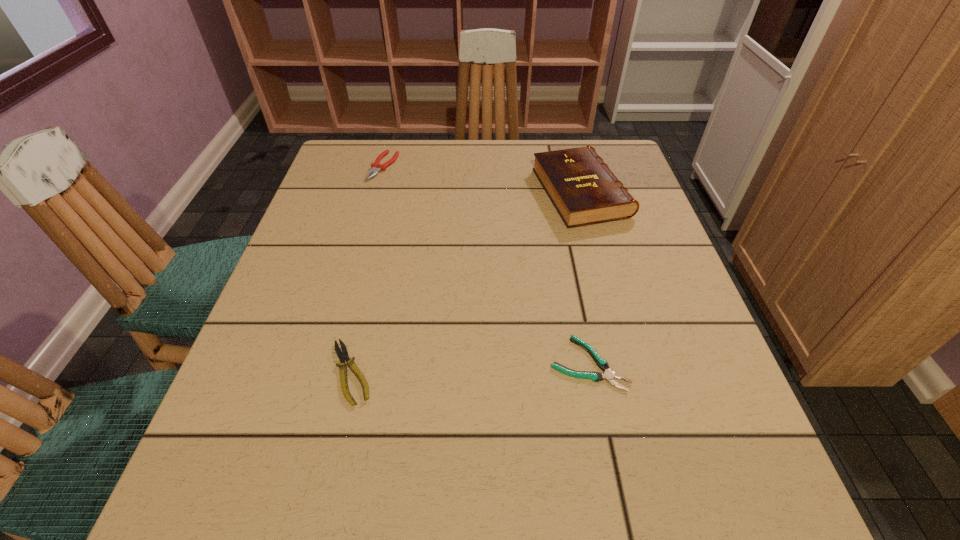
Where is `vacant space at the far left corner of the desktop`? The image size is (960, 540). vacant space at the far left corner of the desktop is located at coordinates (354, 157).

The width and height of the screenshot is (960, 540). Find the location of `vacant point located between the tallest object and the farthest pliers`. vacant point located between the tallest object and the farthest pliers is located at coordinates (483, 179).

Where is `free point between the shortest object and the second tallest object`? free point between the shortest object and the second tallest object is located at coordinates (486, 265).

Identify the location of free space between the hardback book and the second tallest object. (483, 179).

Locate an element on the screen. The width and height of the screenshot is (960, 540). vacant space that's between the second tallest pliers and the tallest pliers is located at coordinates (x=368, y=269).

Identify the location of vacant point located between the shortest pliers and the hardback book. The height and width of the screenshot is (540, 960). (585, 278).

Locate an element on the screen. The image size is (960, 540). free spot between the tallest object and the third shortest object is located at coordinates (483, 179).

Find the location of a particular element. empty space between the second shortest pliers and the tallest object is located at coordinates (467, 282).

In order to click on empty space between the farthest pliers and the rightmost pliers in this screenshot , I will do `click(486, 265)`.

You are a GUI agent. You are given a task and a screenshot of the screen. Output one action in this format:
    pyautogui.click(x=<x>, y=<y>)
    Task: Click on the free space between the tallest object and the rightmost pliers
    This screenshot has width=960, height=540.
    Given the screenshot: What is the action you would take?
    pyautogui.click(x=585, y=278)